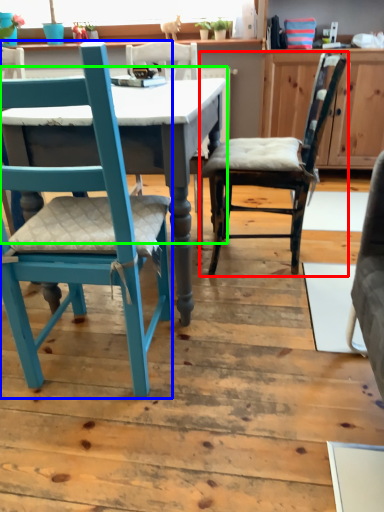
Question: Considering the real-world distances, which object is farthest from chair (highlighted by a red box)? chair (highlighted by a blue box) or table (highlighted by a green box)?

Choices:
 (A) chair
 (B) table

Answer: (A)